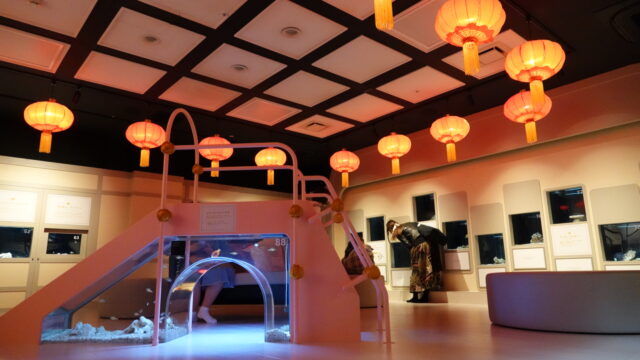
What are the coordinates of `window` in the screenshot? It's located at (525, 232).